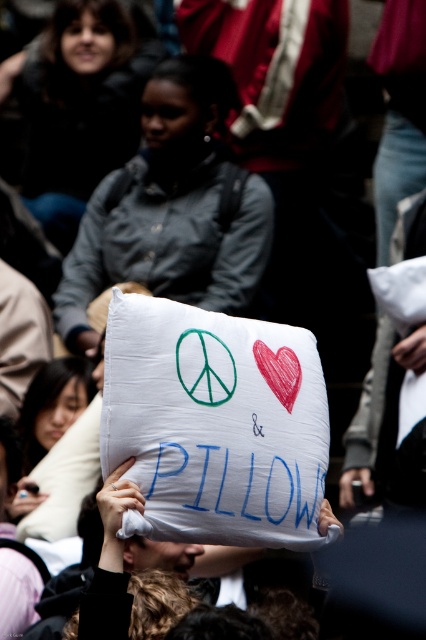
Can you confirm if gray fabric pillow at center is positioned to the left of dark gray jacket at upper left?

Incorrect, gray fabric pillow at center is not on the left side of dark gray jacket at upper left.

Does gray fabric pillow at center have a lesser height compared to dark gray jacket at upper left?

In fact, gray fabric pillow at center may be taller than dark gray jacket at upper left.

Between point (101, 234) and point (106, 38), which one is positioned behind?

Point (106, 38)

This screenshot has height=640, width=426. What are the coordinates of `gray fabric pillow at center` in the screenshot? It's located at (170, 209).

What do you see at coordinates (80, 106) in the screenshot?
I see `dark gray jacket at upper left` at bounding box center [80, 106].

Does point (42, 141) come farther from viewer compared to point (89, 408)?

Yes, point (42, 141) is behind point (89, 408).

Who is more distant from viewer, (94, 65) or (69, 467)?

The point (94, 65) is more distant.

At what (x,y) coordinates should I click in order to perform the action: click on dark gray jacket at upper left. Please return your answer as a coordinate pair (x, y). The height and width of the screenshot is (640, 426). Looking at the image, I should click on (80, 106).

Is white soft pillow at center taller than white fabric pillow at lower center?

Yes.

Can you confirm if white soft pillow at center is bigger than white fabric pillow at lower center?

Yes, white soft pillow at center is bigger than white fabric pillow at lower center.

Between point (52, 477) and point (55, 364), which one is positioned in front?

Point (52, 477)

You are a GUI agent. You are given a task and a screenshot of the screen. Output one action in this format:
    pyautogui.click(x=<x>, y=<y>)
    Task: Click on the white soft pillow at center
    This screenshot has height=640, width=426.
    Given the screenshot: What is the action you would take?
    pyautogui.click(x=65, y=477)